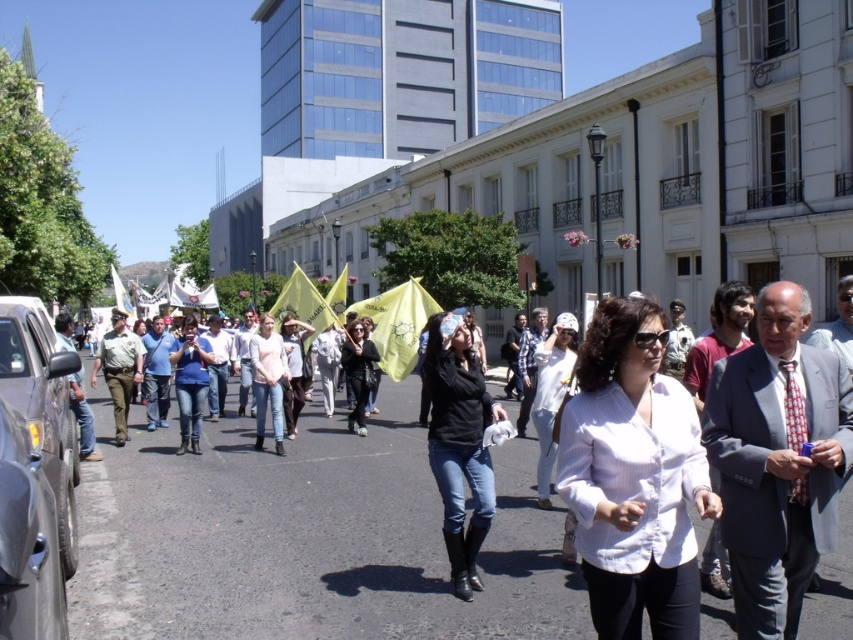
You are a photographer at the event trying to capture a photo of the gray pinstripe suit at center and the matte blue shirt at center. Which person should you focus on first if you want to include both in the frame without moving the camera?

You should focus on the matte blue shirt at center first because the gray pinstripe suit at center is located above it, so by starting with the lower one, you can adjust the framing to include both without moving the camera.

You are a photographer trying to capture a clear shot of both the white shirt at center and the white textured blouse at center in the street scene. Since both are at the center, which one is more likely to be fully visible in your photo?

The white shirt at center is shorter than the white textured blouse at center, so the white shirt at center is more likely to be fully visible in the photo.

You are a photographer trying to capture a photo of the gray pinstripe suit at center and the matte blue shirt at center. If you want to ensure both are fully visible in the frame, which person should you focus on first to avoid cropping either?

You should focus on the gray pinstripe suit at center first since it might be wider than the matte blue shirt at center, ensuring there is enough space for both in the frame.